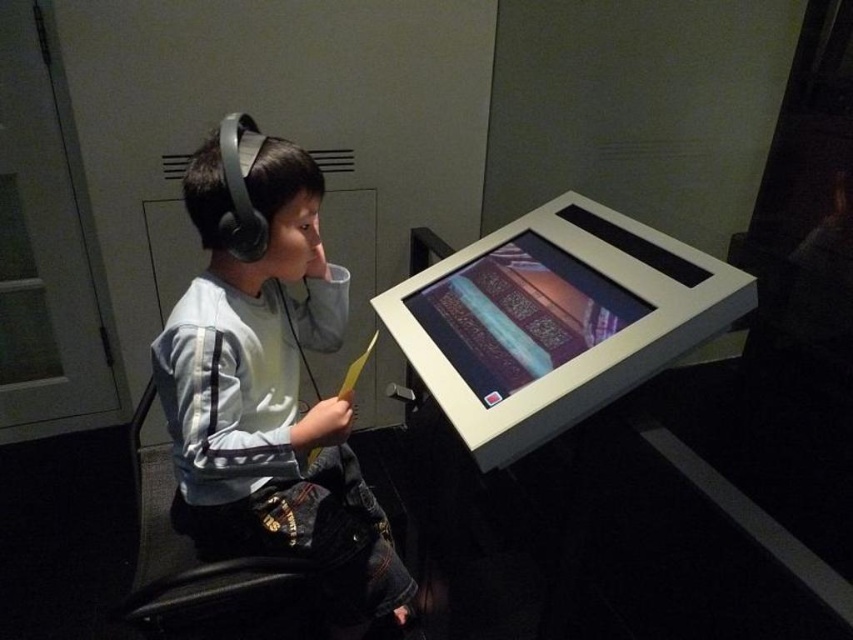
In the scene shown: What are the coordinates of the light gray fabric shirt at center?

The light gray fabric shirt at center is located at point (268, 381).

You are an interior designer observing the scene. You need to determine which object occupies more space in the image between the light gray fabric shirt at center and the black leather chair at left. Based on the scene description, which one is larger?

The light gray fabric shirt at center has a larger size compared to the black leather chair at left, so the light gray fabric shirt at center occupies more space in the image.

You are a visitor in the museum and see the light gray fabric shirt at center and the black leather chair at left. Which object is closer to the ceiling?

The light gray fabric shirt at center is closer to the ceiling because it is located above the black leather chair at left.